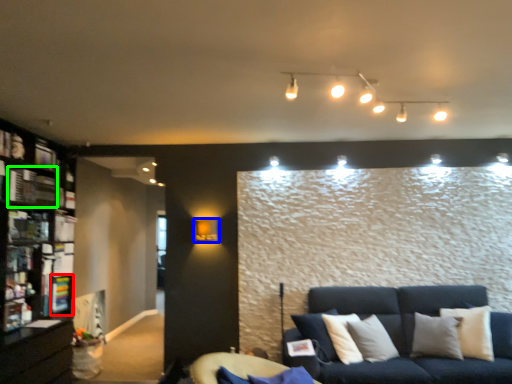
Question: Based on their relative distances, which object is farther from shelf (highlighted by a red box)? Choose from lamp (highlighted by a blue box) and shelf (highlighted by a green box).

Choices:
 (A) lamp
 (B) shelf

Answer: (A)